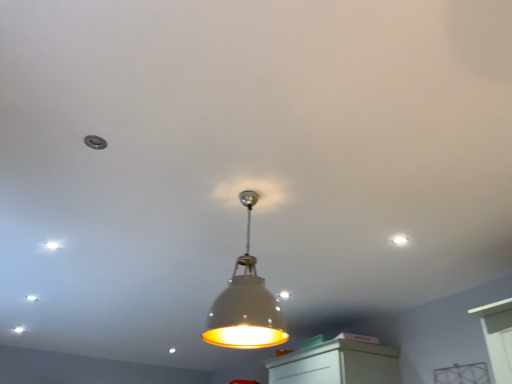
Question: Considering their positions, is white matte lampshade at center located in front of or behind white glossy dot at upper left, the 1th dot from the bottom?

Choices:
 (A) behind
 (B) front

Answer: (B)

Question: Considering the relative positions of white matte lampshade at center and white glossy dot at upper left, which is the second dot in right-to-left order, in the image provided, is white matte lampshade at center to the left or to the right of white glossy dot at upper left, which is the second dot in right-to-left order,?

Choices:
 (A) left
 (B) right

Answer: (B)

Question: Which object is the closest to the white glossy dot at upper left, the 1th dot from the bottom?

Choices:
 (A) white matte lampshade at center
 (B) white matte light fixture at upper center, the first dot when ordered from front to back

Answer: (A)

Question: Which is farther from the white matte light fixture at upper center, positioned as the 2th dot in left-to-right order?

Choices:
 (A) white glossy dot at upper left, the 1th dot from the bottom
 (B) white matte lampshade at center

Answer: (A)